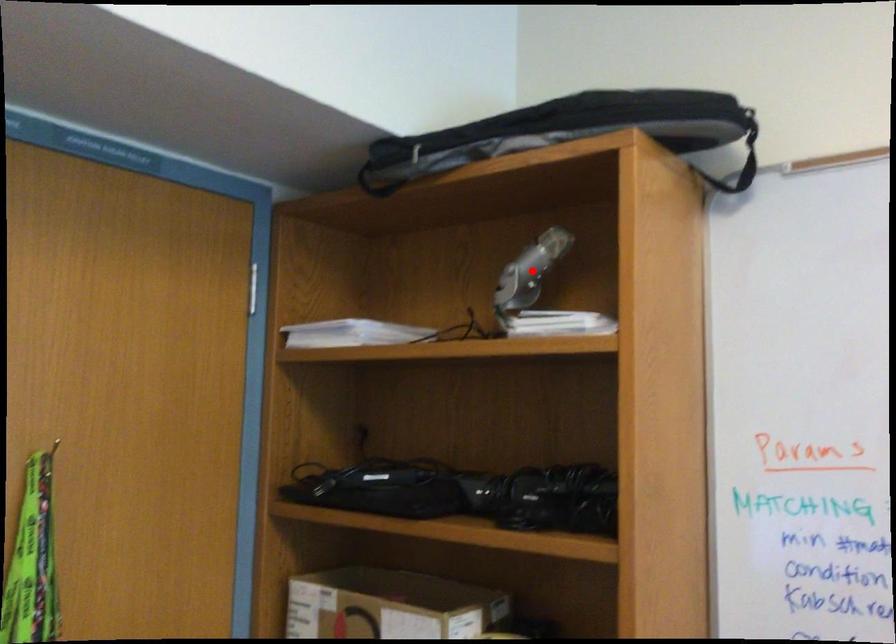
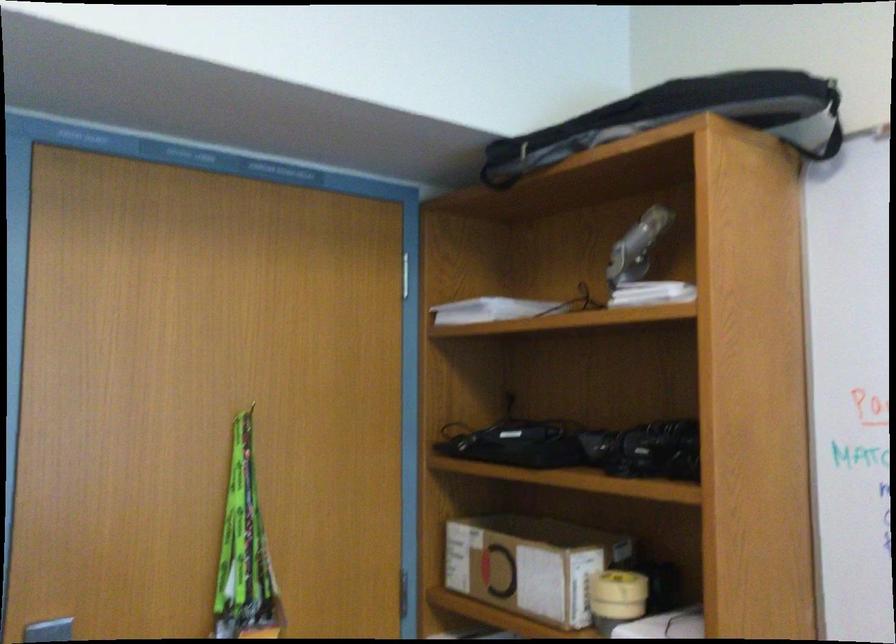
Question: A red point is marked in image1. In image2, is the corresponding 3D point closer to the camera or farther? Reply with the corresponding letter.

Choices:
 (A) The corresponding 3D point is closer.
 (B) The corresponding 3D point is farther.

Answer: (B)